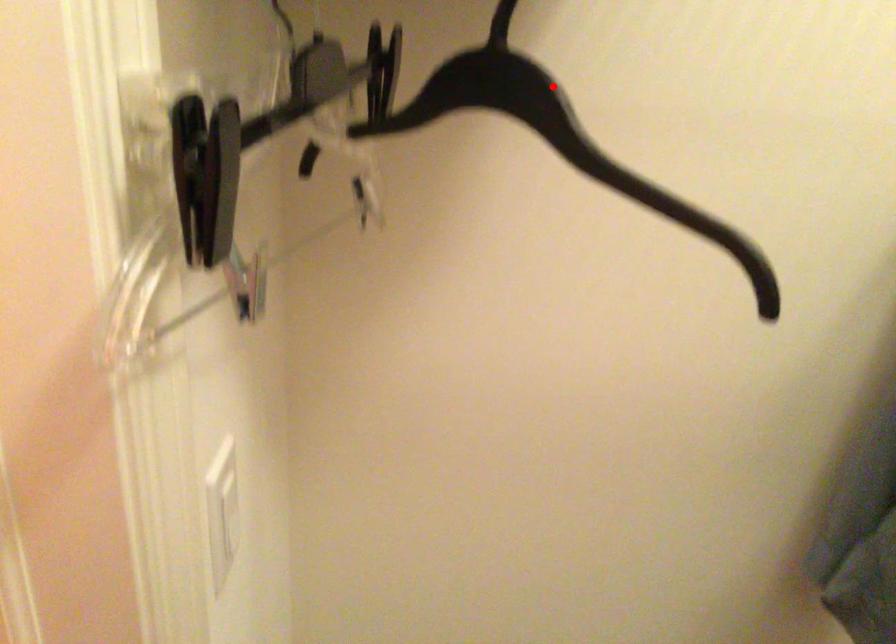
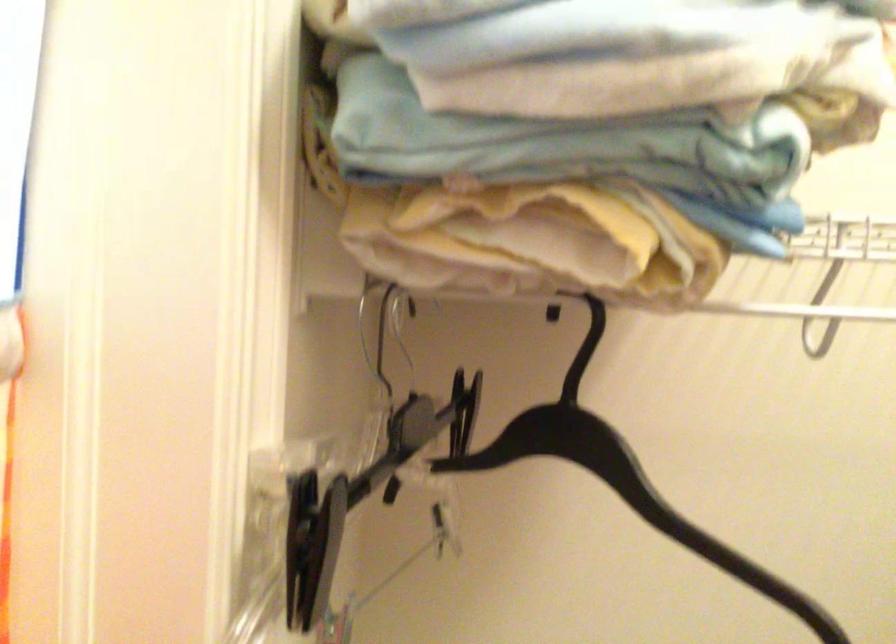
The point at the highlighted location is marked in the first image. Where is the corresponding point in the second image?

(624, 478)